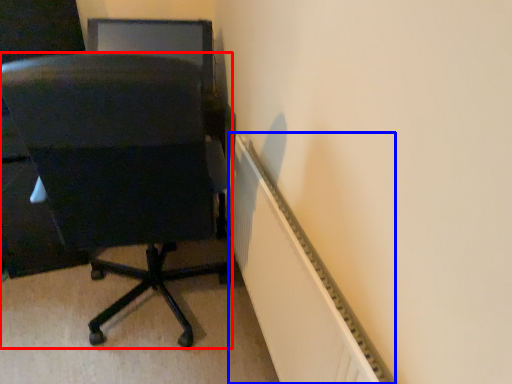
Question: Which object is closer to the camera taking this photo, chair (highlighted by a red box) or radiator (highlighted by a blue box)?

Choices:
 (A) chair
 (B) radiator

Answer: (B)